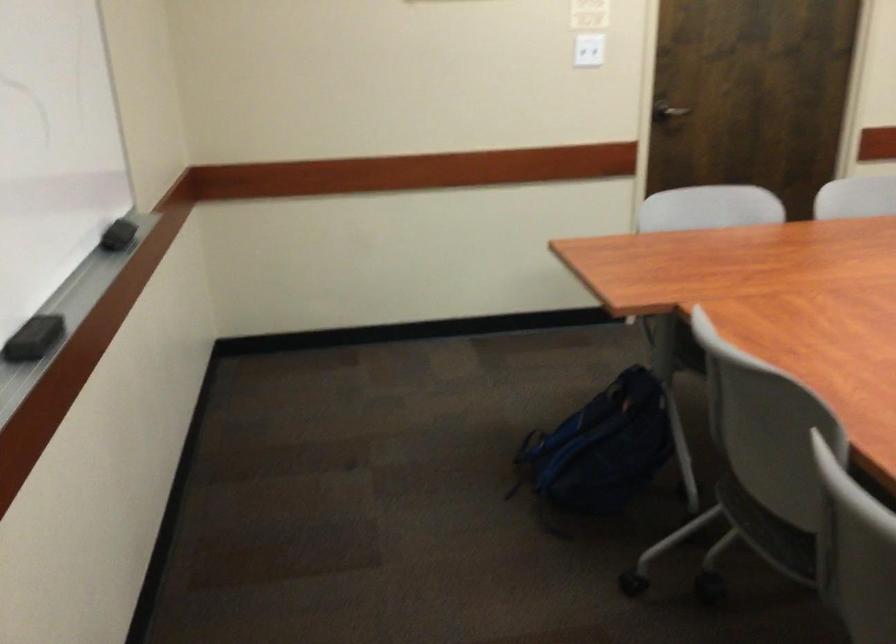
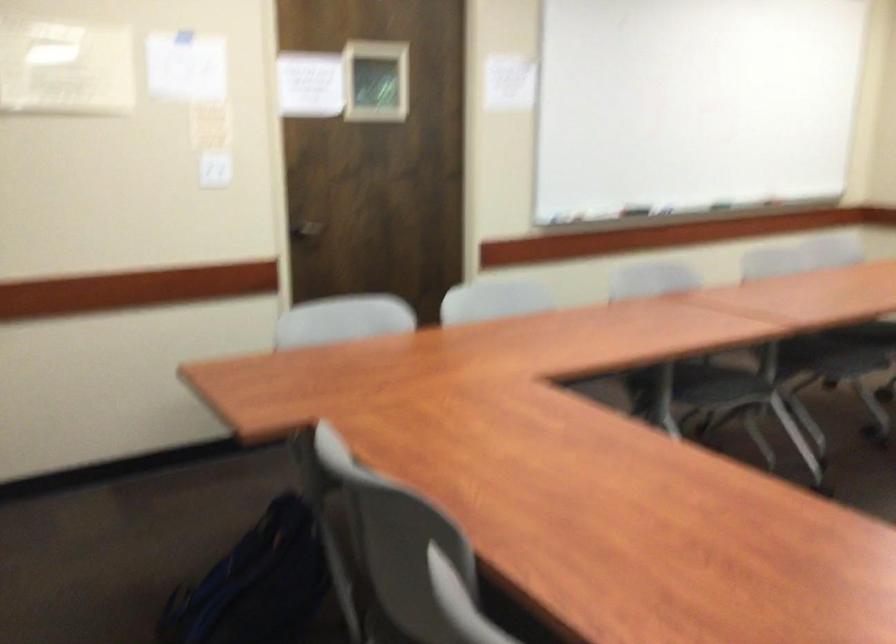
Where in the second image is the point corresponding to [613,444] from the first image?

(254, 583)